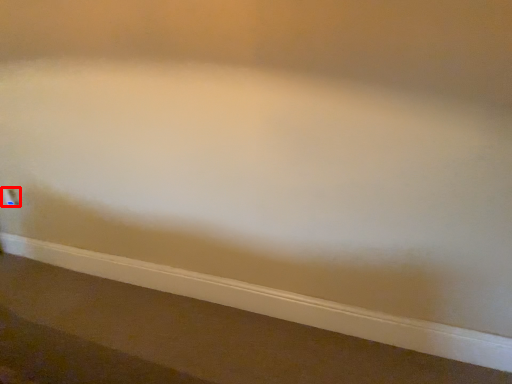
Question: Considering the relative positions of electric outlet (annotated by the red box) and ledge in the image provided, where is electric outlet (annotated by the red box) located with respect to the staircase?

Choices:
 (A) left
 (B) right

Answer: (A)